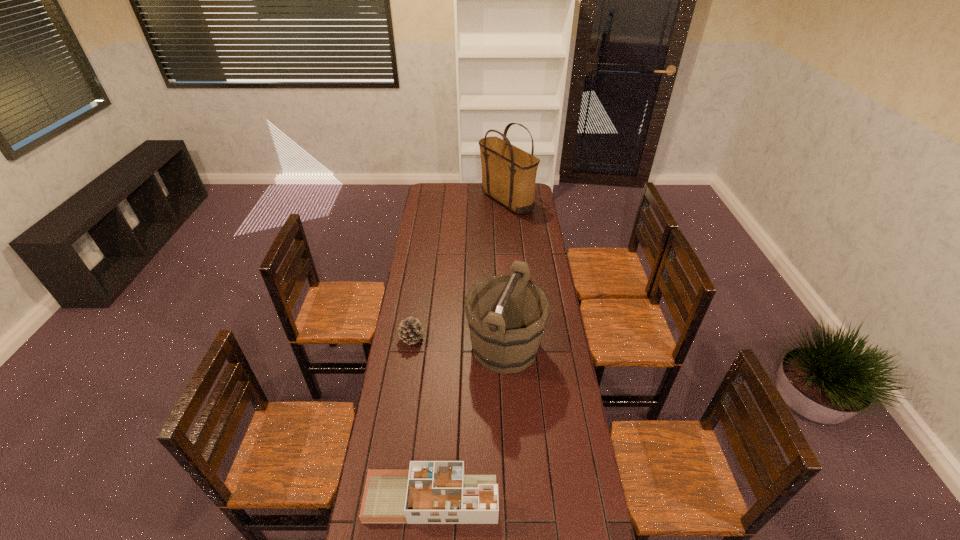
The image size is (960, 540). In order to click on object that is at the far edge in this screenshot , I will do `click(508, 173)`.

The image size is (960, 540). Identify the location of pinecone that is at the left edge. (409, 331).

Identify the location of dollhouse that is at the left edge. (431, 492).

I want to click on tote bag that is at the right edge, so click(508, 173).

Identify the location of bucket that is at the right edge. point(506,318).

The height and width of the screenshot is (540, 960). I want to click on object that is at the far right corner, so click(508, 173).

At what (x,y) coordinates should I click in order to perform the action: click on vacant space at the far edge of the desktop. Please return your answer as a coordinate pair (x, y). The width and height of the screenshot is (960, 540). Looking at the image, I should click on (472, 188).

The width and height of the screenshot is (960, 540). Identify the location of vacant space at the left edge of the desktop. (408, 450).

Identify the location of free space at the right edge. This screenshot has width=960, height=540. (531, 224).

Locate an element on the screen. free space between the nearest object and the third shortest object is located at coordinates (468, 423).